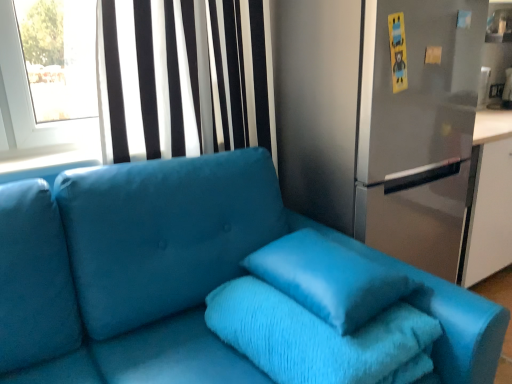
Question: Based on their positions, is satin silver fridge at center located to the left or right of satin black curtain at upper left?

Choices:
 (A) left
 (B) right

Answer: (B)

Question: Considering the positions of satin silver fridge at center and satin black curtain at upper left in the image, is satin silver fridge at center bigger or smaller than satin black curtain at upper left?

Choices:
 (A) small
 (B) big

Answer: (B)

Question: Based on their relative distances, which object is farther from the satin blue couch at center?

Choices:
 (A) turquoise plush bath towel at center
 (B) satin black curtain at upper left
 (C) satin blue pillow at center
 (D) satin silver fridge at center

Answer: (D)

Question: Based on their relative distances, which object is nearer to the satin blue couch at center?

Choices:
 (A) turquoise plush bath towel at center
 (B) satin blue pillow at center
 (C) satin silver fridge at center
 (D) satin black curtain at upper left

Answer: (A)